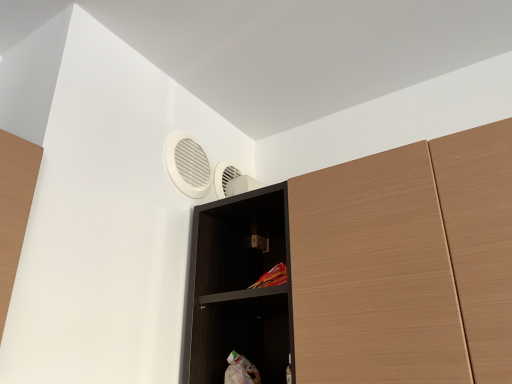
Question: From a real-world perspective, is wooden cupboard at upper right physically located above or below white plastic air conditioning at upper center?

Choices:
 (A) above
 (B) below

Answer: (B)

Question: In terms of size, does wooden cupboard at upper right appear bigger or smaller than white plastic air conditioning at upper center?

Choices:
 (A) small
 (B) big

Answer: (B)

Question: Estimate the real-world distances between objects in this image. Which object is closer to the wooden cupboard at upper right?

Choices:
 (A) black wood shelf at upper center
 (B) white plastic air conditioning at upper center

Answer: (A)

Question: Which is farther from the black wood shelf at upper center?

Choices:
 (A) white plastic air conditioning at upper center
 (B) wooden cupboard at upper right

Answer: (A)